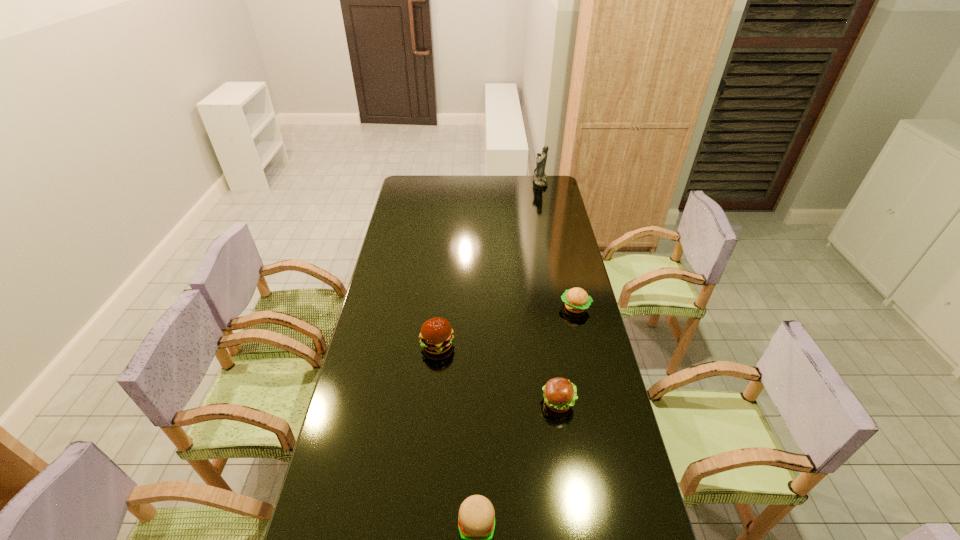
Where is `vacant space at the far left corner of the desktop`? This screenshot has width=960, height=540. vacant space at the far left corner of the desktop is located at coordinates (409, 188).

The image size is (960, 540). Identify the location of vacant point located between the farthest hamburger and the figurine. (558, 244).

This screenshot has height=540, width=960. I want to click on blank region between the figurine and the second farthest object, so click(558, 244).

Where is `blank region between the fourth nearest object and the figurine`? The width and height of the screenshot is (960, 540). blank region between the fourth nearest object and the figurine is located at coordinates (558, 244).

Locate an element on the screen. The height and width of the screenshot is (540, 960). free space between the second farthest object and the third nearest object is located at coordinates (506, 326).

This screenshot has width=960, height=540. Find the location of `empty location between the rightmost hamburger and the second farthest hamburger`. empty location between the rightmost hamburger and the second farthest hamburger is located at coordinates (506, 326).

Find the location of `object that is the closest to the leftmost hamburger`. object that is the closest to the leftmost hamburger is located at coordinates (560, 395).

You are a GUI agent. You are given a task and a screenshot of the screen. Output one action in this format:
    pyautogui.click(x=<x>, y=<y>)
    Task: Click on the object identified as the second closest to the leftmost hamburger
    The width and height of the screenshot is (960, 540).
    Given the screenshot: What is the action you would take?
    pyautogui.click(x=576, y=300)

Point out which hamburger is positioned as the third nearest to the nearest object. Please provide its 2D coordinates. Your answer should be formatted as a tuple, i.e. [(x, y)], where the tuple contains the x and y coordinates of a point satisfying the conditions above.

[(576, 300)]

Image resolution: width=960 pixels, height=540 pixels. In order to click on the closest hamburger relative to the third farthest object in this screenshot , I will do `click(560, 395)`.